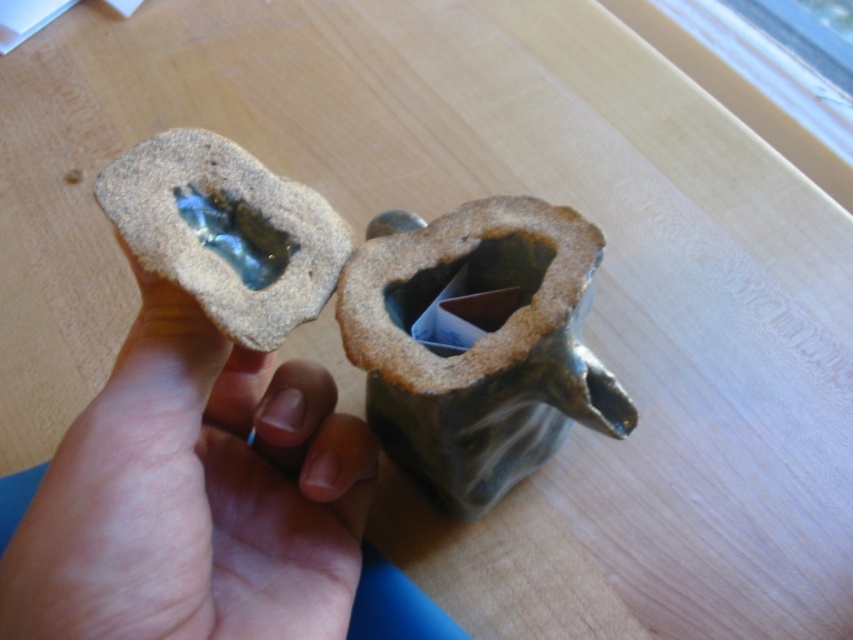
Question: Considering the real-world distances, which object is farthest from the translucent glass at center?

Choices:
 (A) green matte vase at center
 (B) matte brown hand at center

Answer: (A)

Question: Considering the relative positions of matte brown hand at center and green matte vase at center in the image provided, where is matte brown hand at center located with respect to green matte vase at center?

Choices:
 (A) right
 (B) left

Answer: (B)

Question: Can you confirm if green matte vase at center is thinner than translucent glass at center?

Choices:
 (A) no
 (B) yes

Answer: (A)

Question: Estimate the real-world distances between objects in this image. Which object is closer to the translucent glass at center?

Choices:
 (A) green matte vase at center
 (B) matte brown hand at center

Answer: (B)

Question: Where is matte brown hand at center located in relation to translucent glass at center in the image?

Choices:
 (A) right
 (B) left

Answer: (B)

Question: Among these objects, which one is nearest to the camera?

Choices:
 (A) green matte vase at center
 (B) matte brown hand at center
 (C) translucent glass at center

Answer: (B)